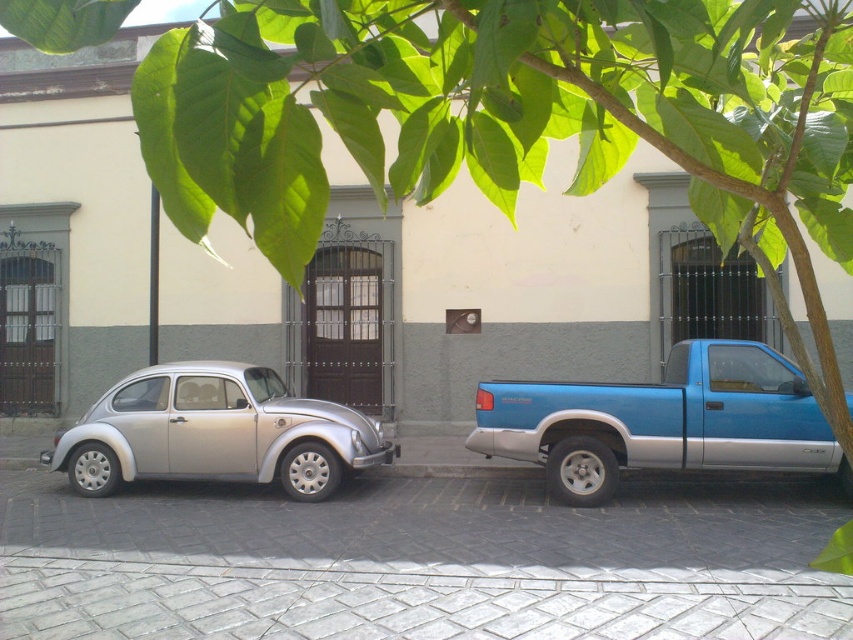
Between blue metallic pickup truck at right and silver metallic car at left, which one appears on the right side from the viewer's perspective?

From the viewer's perspective, blue metallic pickup truck at right appears more on the right side.

Is blue metallic pickup truck at right positioned at the back of silver metallic car at left?

No, it is not.

Does point (622, 444) come behind point (161, 426)?

No, it is in front of (161, 426).

Locate an element on the screen. This screenshot has height=640, width=853. blue metallic pickup truck at right is located at coordinates (662, 420).